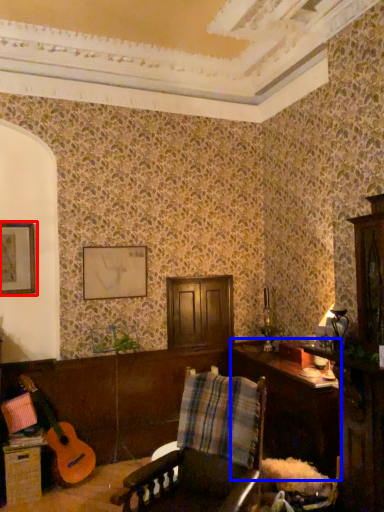
Question: Which object appears farthest to the camera in this image, picture frame (highlighted by a red box) or table (highlighted by a blue box)?

Choices:
 (A) picture frame
 (B) table

Answer: (A)